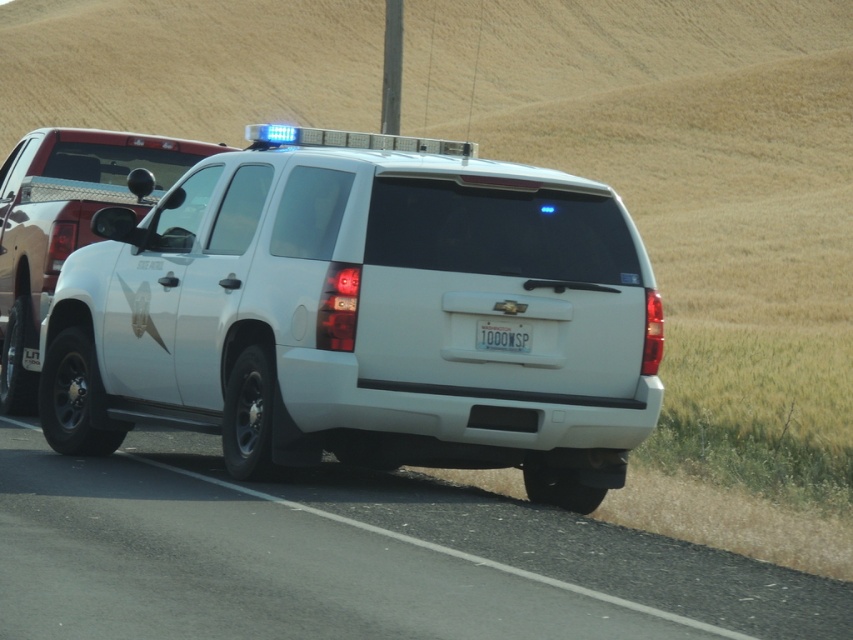
The image size is (853, 640). Describe the element at coordinates (350, 560) in the screenshot. I see `white rubber highway at center` at that location.

Identify the location of white rubber highway at center. (350, 560).

Is point (531, 534) positioned behind point (518, 323)?

No, (531, 534) is in front of (518, 323).

At what (x,y) coordinates should I click in order to perform the action: click on white rubber highway at center. Please return your answer as a coordinate pair (x, y). Image resolution: width=853 pixels, height=640 pixels. Looking at the image, I should click on (350, 560).

Is white matte suv at center behind white plastic license plate at center?

No, white matte suv at center is closer to the viewer.

Based on the photo, can you confirm if white matte suv at center is smaller than white plastic license plate at center?

No.

Which is behind, point (215, 392) or point (518, 342)?

Positioned behind is point (215, 392).

Locate an element on the screen. white matte suv at center is located at coordinates (363, 316).

Which is below, white rubber highway at center or white glossy suv at center?

Positioned lower is white rubber highway at center.

Is white rubber highway at center smaller than white glossy suv at center?

Indeed, white rubber highway at center has a smaller size compared to white glossy suv at center.

Is point (370, 529) behind point (36, 280)?

No, (370, 529) is in front of (36, 280).

Locate an element on the screen. This screenshot has width=853, height=640. white rubber highway at center is located at coordinates (350, 560).